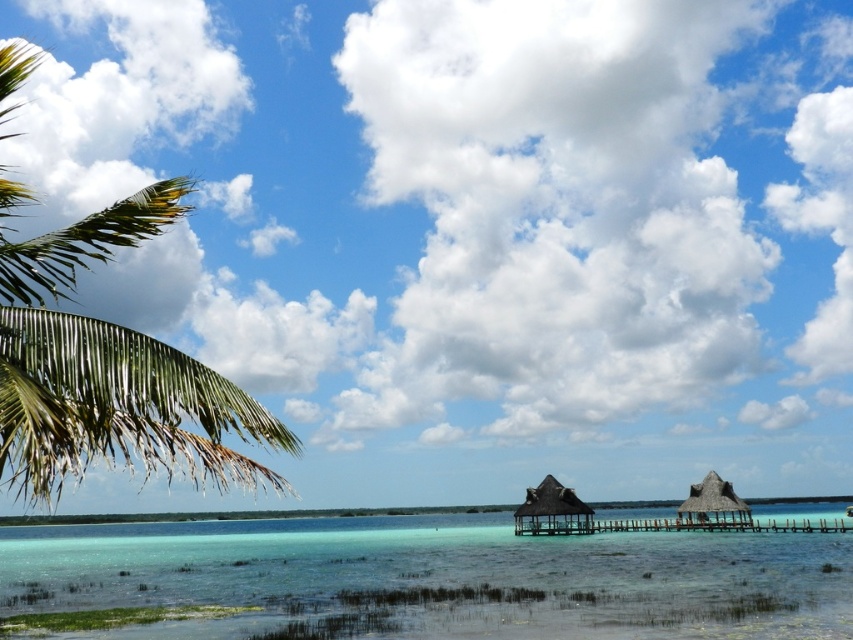
You are standing on the wooden walkway between the two thatched huts in the middle of the image. You want to reach the green leafy palm tree at left without getting your feet wet. Can you walk directly from the wooden walkway to the palm tree without stepping into the clear water at lower center?

The clear water at lower center is 140.96 feet away from the green leafy palm tree at left. Since the walkway is between the huts and the palm tree is on the left, you can walk along the walkway towards the left to reach the palm tree without stepping into the water.

You are standing on the wooden walkway between the two thatched huts. You want to get to the clear water at lower center. Which direction should you move relative to the green leafy palm tree at left?

The clear water at lower center is to the right of the green leafy palm tree at left, so you should move towards the right side of the palm tree to reach the water.